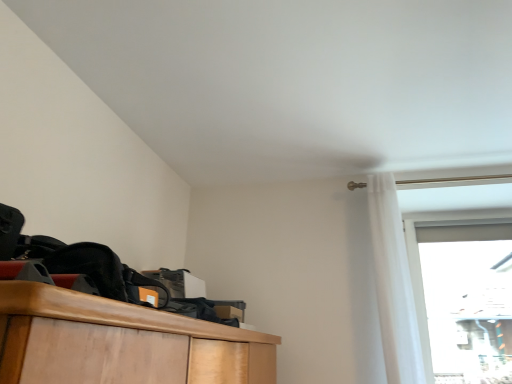
Question: Should I look upward or downward to see transparent glass door at upper right?

Choices:
 (A) down
 (B) up

Answer: (A)

Question: Would you say transparent glass door at upper right is part of white sheer curtain at upper right's contents?

Choices:
 (A) no
 (B) yes

Answer: (A)

Question: Does white sheer curtain at upper right have a lesser width compared to transparent glass door at upper right?

Choices:
 (A) yes
 (B) no

Answer: (B)

Question: From the image's perspective, is white sheer curtain at upper right over transparent glass door at upper right?

Choices:
 (A) no
 (B) yes

Answer: (B)

Question: Considering the relative sizes of white sheer curtain at upper right and transparent glass door at upper right in the image provided, is white sheer curtain at upper right taller than transparent glass door at upper right?

Choices:
 (A) yes
 (B) no

Answer: (A)

Question: Is white sheer curtain at upper right completely or partially outside of transparent glass door at upper right?

Choices:
 (A) yes
 (B) no

Answer: (A)

Question: Is the depth of white sheer curtain at upper right greater than that of transparent glass door at upper right?

Choices:
 (A) no
 (B) yes

Answer: (A)

Question: Is transparent glass door at upper right completely or partially outside of white sheer curtain at upper right?

Choices:
 (A) yes
 (B) no

Answer: (A)

Question: Does transparent glass door at upper right appear on the right side of white sheer curtain at upper right?

Choices:
 (A) yes
 (B) no

Answer: (A)

Question: Considering the relative sizes of transparent glass door at upper right and white sheer curtain at upper right in the image provided, is transparent glass door at upper right shorter than white sheer curtain at upper right?

Choices:
 (A) no
 (B) yes

Answer: (B)

Question: Can white sheer curtain at upper right be found inside transparent glass door at upper right?

Choices:
 (A) no
 (B) yes

Answer: (A)

Question: From a real-world perspective, is transparent glass door at upper right on white sheer curtain at upper right?

Choices:
 (A) no
 (B) yes

Answer: (A)

Question: From the image's perspective, is transparent glass door at upper right located beneath white sheer curtain at upper right?

Choices:
 (A) yes
 (B) no

Answer: (A)

Question: Is transparent glass door at upper right inside or outside of white sheer curtain at upper right?

Choices:
 (A) outside
 (B) inside

Answer: (A)